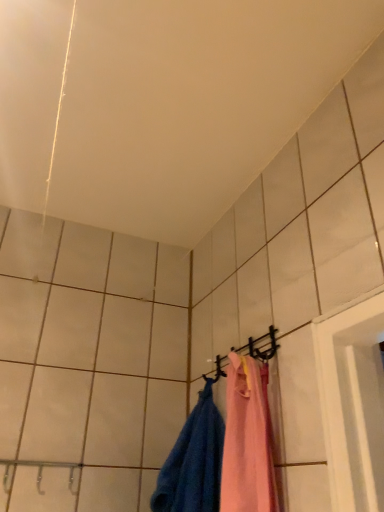
Question: Are blue cotton towel at lower right and black matte hanger at upper center located far from each other?

Choices:
 (A) no
 (B) yes

Answer: (A)

Question: Does blue cotton towel at lower right have a lesser width compared to black matte hanger at upper center?

Choices:
 (A) yes
 (B) no

Answer: (B)

Question: From a real-world perspective, does blue cotton towel at lower right stand above black matte hanger at upper center?

Choices:
 (A) yes
 (B) no

Answer: (B)

Question: Considering the relative sizes of blue cotton towel at lower right and black matte hanger at upper center in the image provided, is blue cotton towel at lower right smaller than black matte hanger at upper center?

Choices:
 (A) no
 (B) yes

Answer: (A)

Question: From the image's perspective, is blue cotton towel at lower right above black matte hanger at upper center?

Choices:
 (A) yes
 (B) no

Answer: (B)

Question: Is blue cotton towel at lower right aimed at black matte hanger at upper center?

Choices:
 (A) no
 (B) yes

Answer: (A)

Question: Is black matte hanger at upper center outside of blue cotton towel at lower right?

Choices:
 (A) no
 (B) yes

Answer: (B)

Question: Is black matte hanger at upper center oriented towards blue cotton towel at lower right?

Choices:
 (A) yes
 (B) no

Answer: (A)

Question: Is black matte hanger at upper center wider than blue cotton towel at lower right?

Choices:
 (A) yes
 (B) no

Answer: (B)

Question: From the image's perspective, is black matte hanger at upper center on blue cotton towel at lower right?

Choices:
 (A) yes
 (B) no

Answer: (A)

Question: Can you confirm if black matte hanger at upper center is smaller than blue cotton towel at lower right?

Choices:
 (A) no
 (B) yes

Answer: (B)

Question: Is black matte hanger at upper center at the right side of blue cotton towel at lower right?

Choices:
 (A) no
 (B) yes

Answer: (B)

Question: Which is correct: blue cotton towel at lower right is inside black matte hanger at upper center, or outside of it?

Choices:
 (A) outside
 (B) inside

Answer: (A)